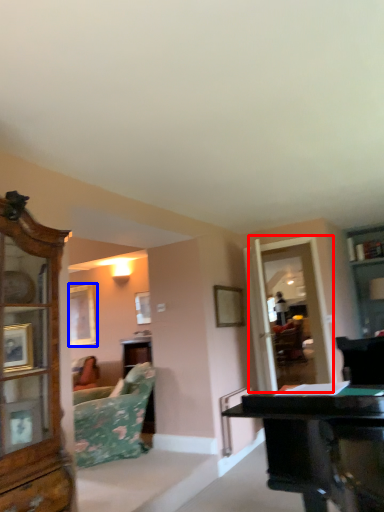
Question: Which object is closer to the camera taking this photo, glass door (highlighted by a red box) or picture frame (highlighted by a blue box)?

Choices:
 (A) glass door
 (B) picture frame

Answer: (A)